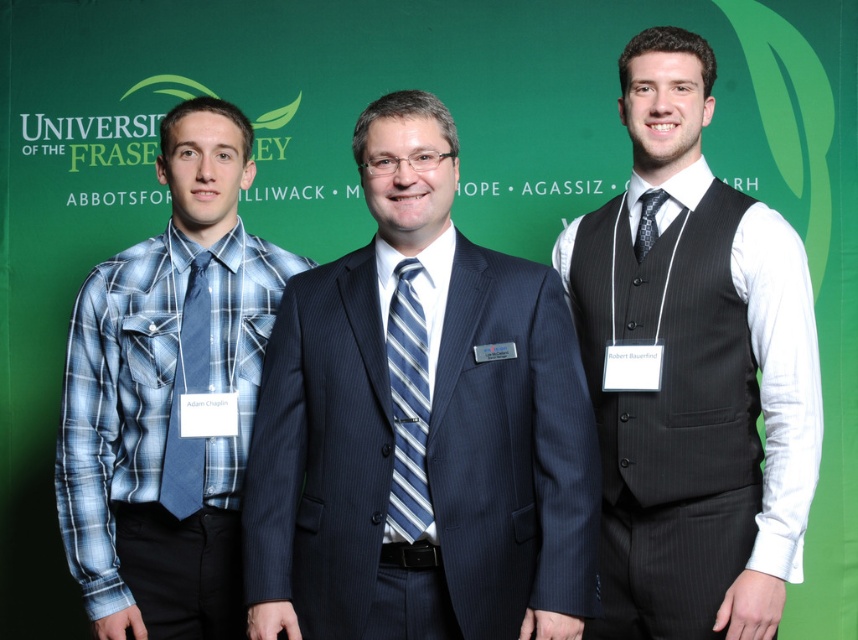
Is blue plaid shirt at left to the left of black textured tie at right from the viewer's perspective?

Indeed, blue plaid shirt at left is positioned on the left side of black textured tie at right.

This screenshot has height=640, width=858. What do you see at coordinates (168, 396) in the screenshot?
I see `blue plaid shirt at left` at bounding box center [168, 396].

Where is `blue plaid shirt at left`? The height and width of the screenshot is (640, 858). blue plaid shirt at left is located at coordinates (168, 396).

Measure the distance between blue plaid tie at left and camera.

blue plaid tie at left is 2.08 meters away from camera.

Does blue plaid tie at left have a lesser width compared to black textured tie at right?

Incorrect, blue plaid tie at left's width is not less than black textured tie at right's.

What do you see at coordinates (188, 392) in the screenshot? I see `blue plaid tie at left` at bounding box center [188, 392].

Where is `blue plaid tie at left`? blue plaid tie at left is located at coordinates (188, 392).

Can you confirm if black pinstripe vest at center is positioned below black textured tie at right?

Indeed, black pinstripe vest at center is positioned under black textured tie at right.

Is black pinstripe vest at center smaller than black textured tie at right?

No, black pinstripe vest at center is not smaller than black textured tie at right.

This screenshot has height=640, width=858. Describe the element at coordinates (693, 372) in the screenshot. I see `black pinstripe vest at center` at that location.

The height and width of the screenshot is (640, 858). In order to click on black pinstripe vest at center in this screenshot , I will do `click(693, 372)`.